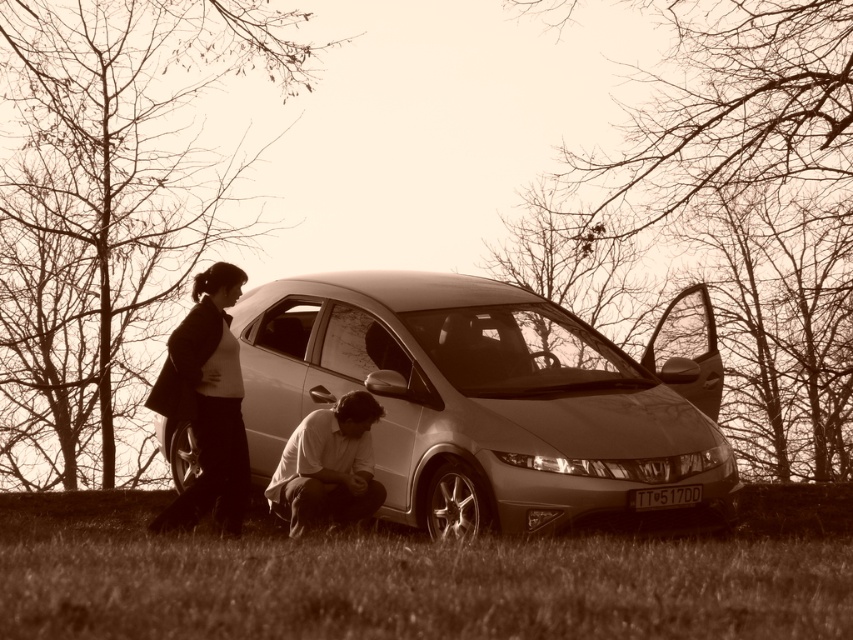
You are a pedestrian walking along the path in the image. You notice the green grass at lower center and the matte black jacket at left. Which object is closer to the ground?

The green grass at lower center is positioned under matte black jacket at left, so the green grass at lower center is closer to the ground.

You are a pedestrian standing on the sidewalk observing the scene. You notice the satin silver car at center and the matte white shirt at lower center. Which object is closer to you?

The satin silver car at center is closer to you because it is positioned further to the viewer than the matte white shirt at lower center, meaning it appears nearer in the visual perspective.